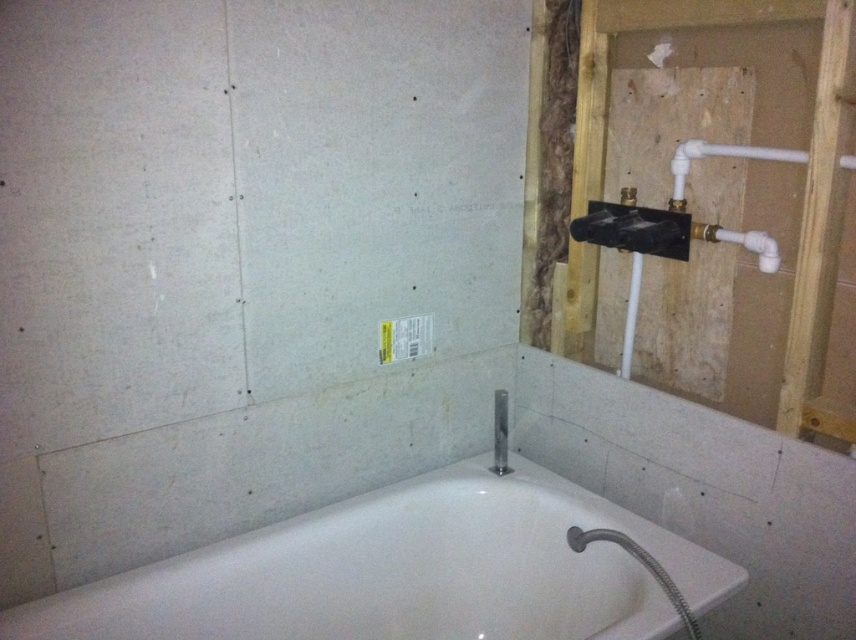
Is white glossy bathtub at center wider than satin nickel showerhead at upper center?

Yes, white glossy bathtub at center is wider than satin nickel showerhead at upper center.

Image resolution: width=856 pixels, height=640 pixels. What do you see at coordinates (406, 572) in the screenshot?
I see `white glossy bathtub at center` at bounding box center [406, 572].

You are a GUI agent. You are given a task and a screenshot of the screen. Output one action in this format:
    pyautogui.click(x=<x>, y=<y>)
    Task: Click on the white glossy bathtub at center
    
    Given the screenshot: What is the action you would take?
    pyautogui.click(x=406, y=572)